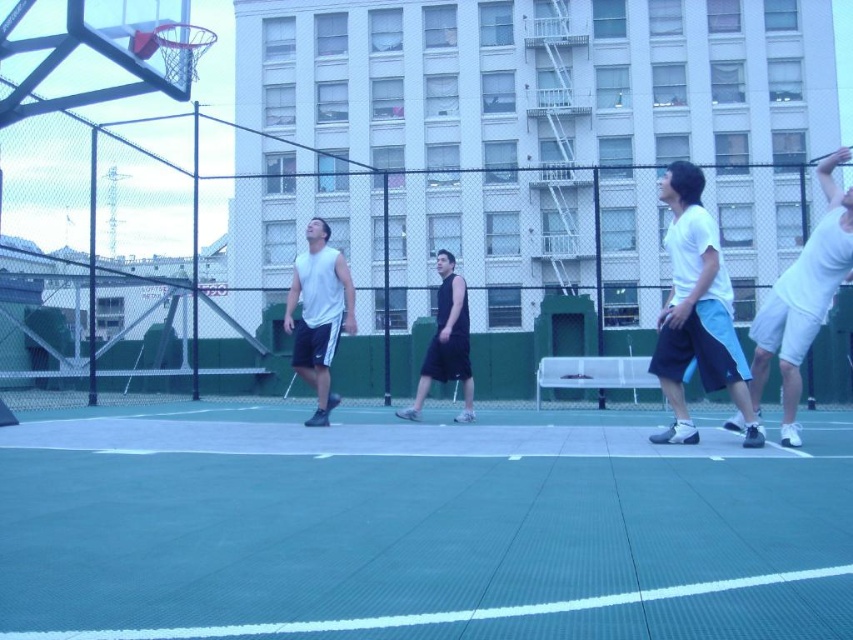
Is white matte shorts at right shorter than black sleeveless shirt at center?

Yes.

Is point (711, 253) closer to viewer compared to point (459, 356)?

Yes, point (711, 253) is in front of point (459, 356).

The height and width of the screenshot is (640, 853). Describe the element at coordinates (695, 310) in the screenshot. I see `white matte shorts at right` at that location.

The height and width of the screenshot is (640, 853). In order to click on white matte shorts at right in this screenshot , I will do `click(695, 310)`.

Can you confirm if metallic silver basketball hoop at upper left is smaller than white matte tank top at center?

Actually, metallic silver basketball hoop at upper left might be larger than white matte tank top at center.

Is point (103, 92) farther from camera compared to point (337, 396)?

No, (103, 92) is closer to viewer.

Image resolution: width=853 pixels, height=640 pixels. Identify the location of metallic silver basketball hoop at upper left. (102, 54).

Find the location of a particular element. metallic silver basketball hoop at upper left is located at coordinates [102, 54].

Is white matte tank top at center positioned before shiny metallic basketball at upper left?

Yes, white matte tank top at center is closer to the viewer.

Image resolution: width=853 pixels, height=640 pixels. Find the location of `white matte tank top at center`. white matte tank top at center is located at coordinates (318, 314).

Image resolution: width=853 pixels, height=640 pixels. In order to click on white matte tank top at center in this screenshot , I will do `click(318, 314)`.